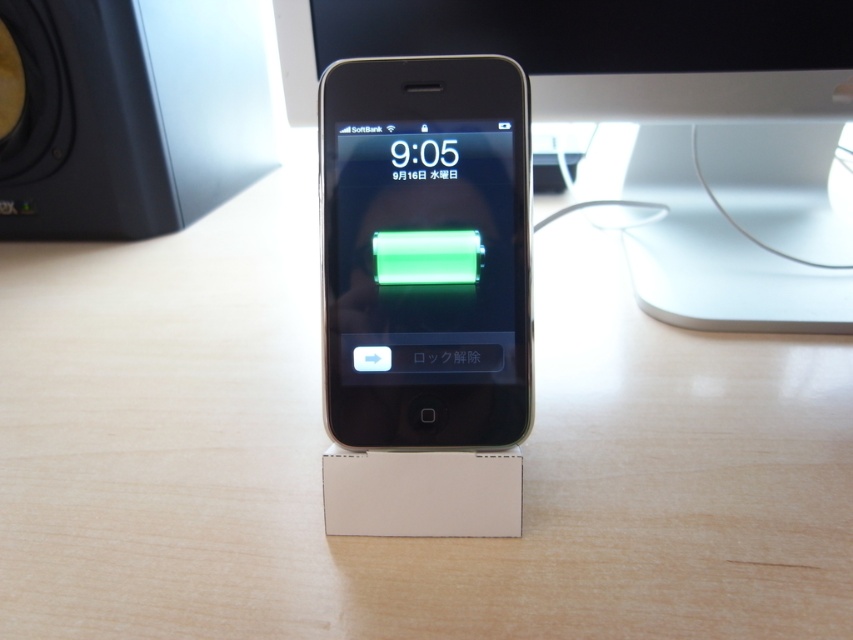
You are setting up a music system in your room. You have a satin black ipod at center and a black matte speaker at upper left. Where should you place the speaker relative to the ipod to match the image?

The black matte speaker at upper left should be placed to the left of the satin black ipod at center to match the image since the satin black ipod at center is to the right of the black matte speaker at upper left in the scene.

You are standing 5 feet away from the desk. The point on the desk at coordinate point (630, 212) is where you want to place a small object. Can you reach it without moving closer?

The point at coordinate point (630, 212) is 3.64 feet away from the viewer. Since you are standing 5 feet away from the desk, the distance to the point is shorter than your current position. Therefore, you can reach the point without moving closer.

You are trying to locate a specific point on the computer monitor in the image. The point is at coordinates (660, 131). Based on the scene description, where exactly on the computer monitor would this point be located?

The point at coordinates (660, 131) is located on the black glossy computer monitor at upper center.